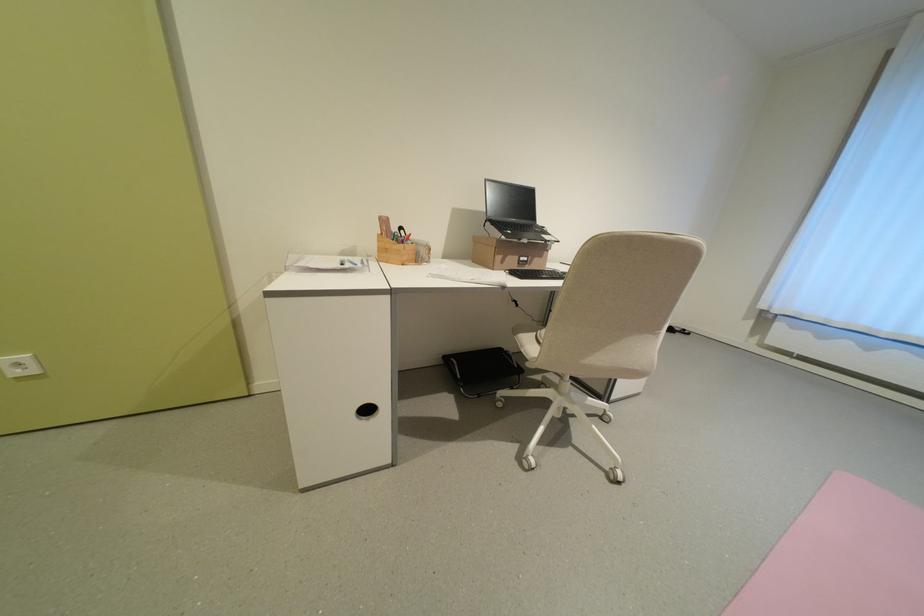
This screenshot has height=616, width=924. What do you see at coordinates (400, 235) in the screenshot?
I see `the black scissors` at bounding box center [400, 235].